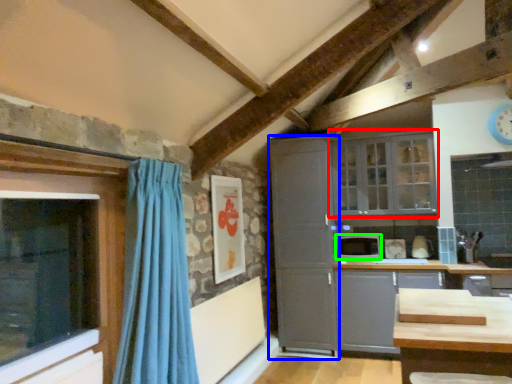
Question: Which is nearer to the window (highlighted by a red box)? cabinetry (highlighted by a blue box) or appliance (highlighted by a green box).

Choices:
 (A) cabinetry
 (B) appliance

Answer: (A)